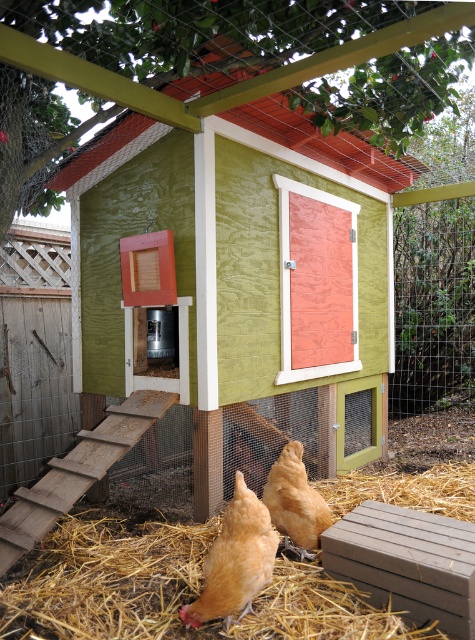
Question: In this image, where is yellow straw at lower center located relative to golden feathered chicken at center?

Choices:
 (A) left
 (B) right

Answer: (A)

Question: Which is farther from the golden feathered chicken at center?

Choices:
 (A) yellow straw at lower center
 (B) green plywood chicken coop at center
 (C) golden feathered chicken at lower center

Answer: (B)

Question: Does golden feathered chicken at lower center have a lesser width compared to golden feathered chicken at center?

Choices:
 (A) no
 (B) yes

Answer: (A)

Question: Which object is positioned closest to the yellow straw at lower center?

Choices:
 (A) golden feathered chicken at center
 (B) green plywood chicken coop at center

Answer: (A)

Question: Does green plywood chicken coop at center appear on the left side of golden feathered chicken at lower center?

Choices:
 (A) yes
 (B) no

Answer: (B)

Question: Which object is the farthest from the golden feathered chicken at center?

Choices:
 (A) yellow straw at lower center
 (B) golden feathered chicken at lower center
 (C) green plywood chicken coop at center

Answer: (C)